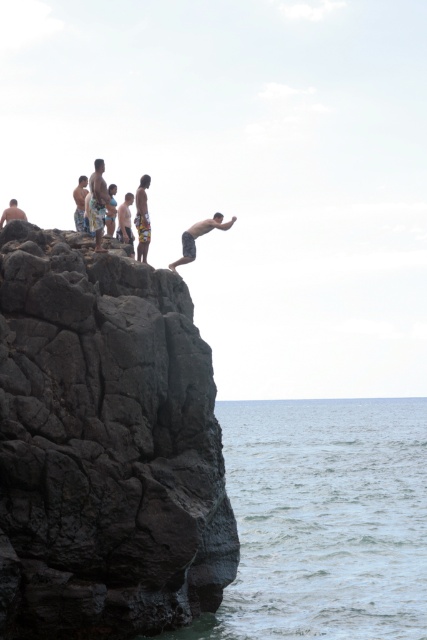
Question: Is dark gray rocky cliff at upper left wider than gray stone man at center?

Choices:
 (A) no
 (B) yes

Answer: (B)

Question: Which object is farther from the camera taking this photo?

Choices:
 (A) dark gray rocky cliff at upper left
 (B) yellow patterned shorts at upper center
 (C) light blue shorts at upper center

Answer: (C)

Question: Does dark gray rocky cliff at upper left have a greater width compared to light blue shorts at upper center?

Choices:
 (A) no
 (B) yes

Answer: (A)

Question: Does yellow patterned shorts at upper center appear under light brown textured shorts at upper left?

Choices:
 (A) no
 (B) yes

Answer: (B)

Question: Which point is closer to the camera?

Choices:
 (A) light blue shorts at upper center
 (B) matte skin person at upper center
 (C) smooth skin man at upper left

Answer: (B)

Question: Which object appears farthest from the camera in this image?

Choices:
 (A) matte skin person at upper center
 (B) dark gray rocky cliff at upper left
 (C) light brown textured shorts at upper left

Answer: (C)